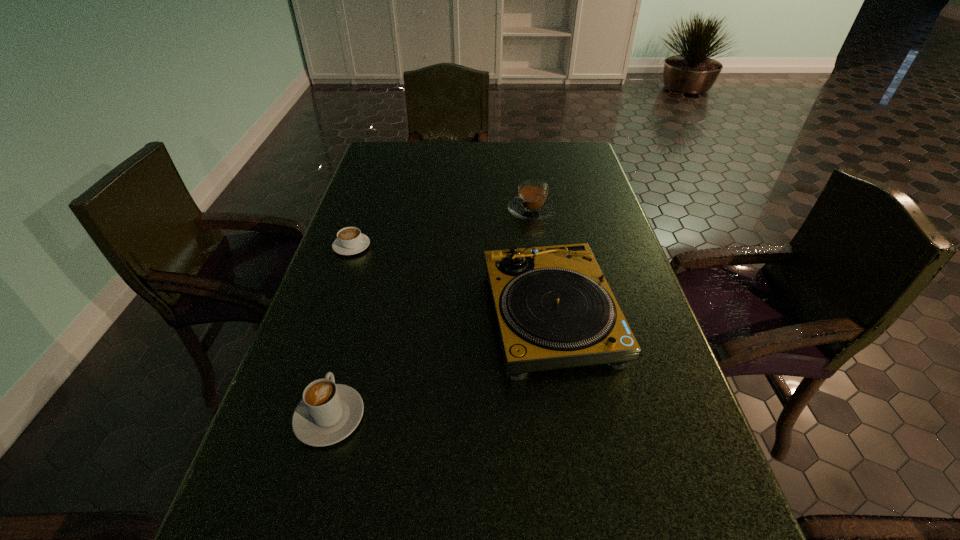
At what (x,y) coordinates should I click in order to perform the action: click on free point between the nearest cappuccino and the record player. Please return your answer as a coordinate pair (x, y). Image resolution: width=960 pixels, height=540 pixels. Looking at the image, I should click on (440, 366).

Locate an element on the screen. This screenshot has height=540, width=960. free space between the second nearest cappuccino and the nearest object is located at coordinates (341, 332).

This screenshot has width=960, height=540. Identify the location of vacant space that's between the shortest object and the record player. (451, 281).

Where is `vacant area between the second nearest cappuccino and the third farthest object`? This screenshot has width=960, height=540. vacant area between the second nearest cappuccino and the third farthest object is located at coordinates (451, 281).

Where is `vacant area that lies between the nearest cappuccino and the rightmost cappuccino`? The width and height of the screenshot is (960, 540). vacant area that lies between the nearest cappuccino and the rightmost cappuccino is located at coordinates (431, 313).

Identify the location of vacant area that lies between the farthest cappuccino and the nearest cappuccino. (431, 313).

Find the location of `blank region between the shortest cappuccino and the tallest object`. blank region between the shortest cappuccino and the tallest object is located at coordinates (451, 281).

The image size is (960, 540). Find the location of `free space between the farthest object and the second nearest cappuccino`. free space between the farthest object and the second nearest cappuccino is located at coordinates (442, 228).

The height and width of the screenshot is (540, 960). What are the coordinates of `object that is the closest to the nearest object` in the screenshot? It's located at (554, 308).

This screenshot has height=540, width=960. I want to click on object identified as the closest to the third nearest object, so click(x=554, y=308).